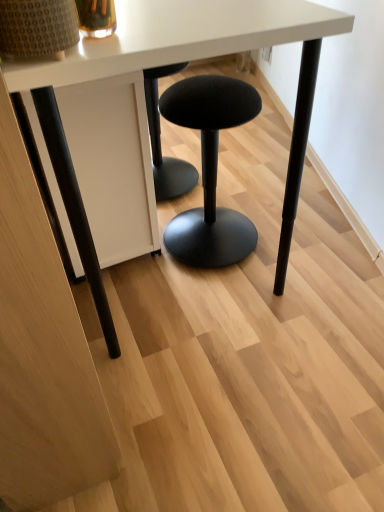
Question: Can you confirm if black fabric stool at center is positioned to the left of white matte table at center?

Choices:
 (A) no
 (B) yes

Answer: (A)

Question: Does black fabric stool at center have a lesser width compared to white matte table at center?

Choices:
 (A) no
 (B) yes

Answer: (B)

Question: Is white matte table at center at the back of black fabric stool at center?

Choices:
 (A) no
 (B) yes

Answer: (A)

Question: From the image's perspective, would you say black fabric stool at center is shown under white matte table at center?

Choices:
 (A) yes
 (B) no

Answer: (A)

Question: Does black fabric stool at center have a larger size compared to white matte table at center?

Choices:
 (A) no
 (B) yes

Answer: (A)

Question: Is black fabric stool at center positioned in front of white matte table at center?

Choices:
 (A) no
 (B) yes

Answer: (B)

Question: Does white matte table at center have a larger size compared to black fabric stool at center?

Choices:
 (A) yes
 (B) no

Answer: (A)

Question: From the image's perspective, is white matte table at center above black fabric stool at center?

Choices:
 (A) yes
 (B) no

Answer: (A)

Question: From a real-world perspective, is white matte table at center on black fabric stool at center?

Choices:
 (A) yes
 (B) no

Answer: (A)

Question: From a real-world perspective, is white matte table at center located beneath black fabric stool at center?

Choices:
 (A) no
 (B) yes

Answer: (A)

Question: Is black fabric stool at center surrounded by white matte table at center?

Choices:
 (A) no
 (B) yes

Answer: (B)

Question: Considering the relative positions of white matte table at center and black fabric stool at center in the image provided, is white matte table at center in front of black fabric stool at center?

Choices:
 (A) yes
 (B) no

Answer: (A)

Question: From a real-world perspective, is black fabric stool at center located beneath black fabric stool at center?

Choices:
 (A) no
 (B) yes

Answer: (B)